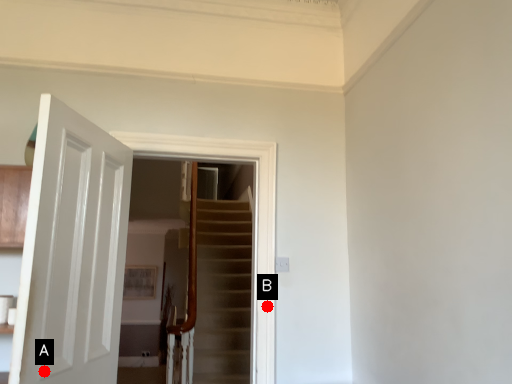
Question: Two points are circled on the image, labeled by A and B beside each circle. Which point is farther from the camera taking this photo?

Choices:
 (A) A is further
 (B) B is further

Answer: (B)